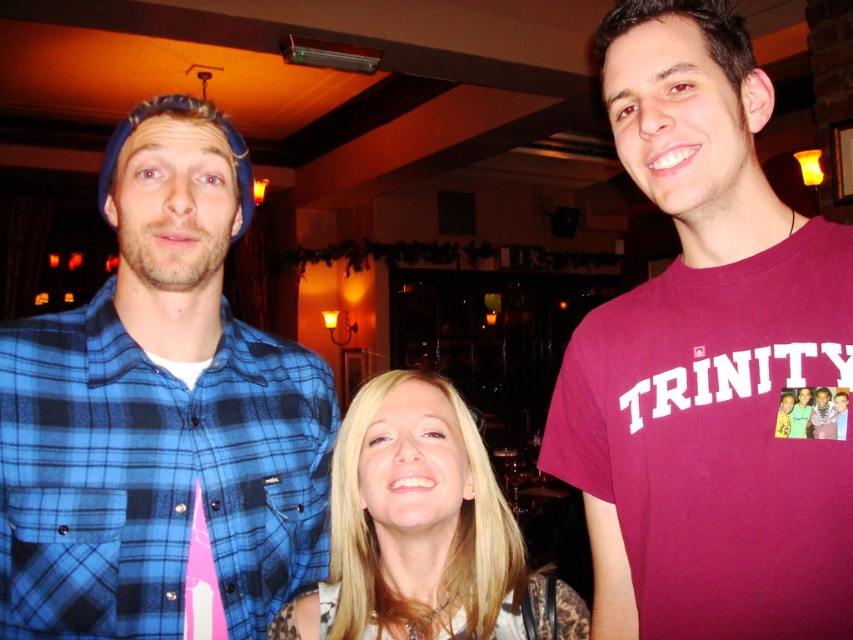
Question: Does maroon t-shirt at center come behind blonde hair at center?

Choices:
 (A) no
 (B) yes

Answer: (A)

Question: Among these objects, which one is farthest from the camera?

Choices:
 (A) blonde hair at center
 (B) maroon t-shirt at center

Answer: (A)

Question: Is maroon t-shirt at center bigger than blonde hair at center?

Choices:
 (A) no
 (B) yes

Answer: (B)

Question: Which object is the farthest from the maroon t-shirt at center?

Choices:
 (A) blonde hair at center
 (B) blue flannel shirt at left

Answer: (B)

Question: Which point is closer to the camera?

Choices:
 (A) blonde hair at center
 (B) blue flannel shirt at left

Answer: (A)

Question: Considering the relative positions of blue flannel shirt at left and blonde hair at center in the image provided, where is blue flannel shirt at left located with respect to blonde hair at center?

Choices:
 (A) left
 (B) right

Answer: (A)